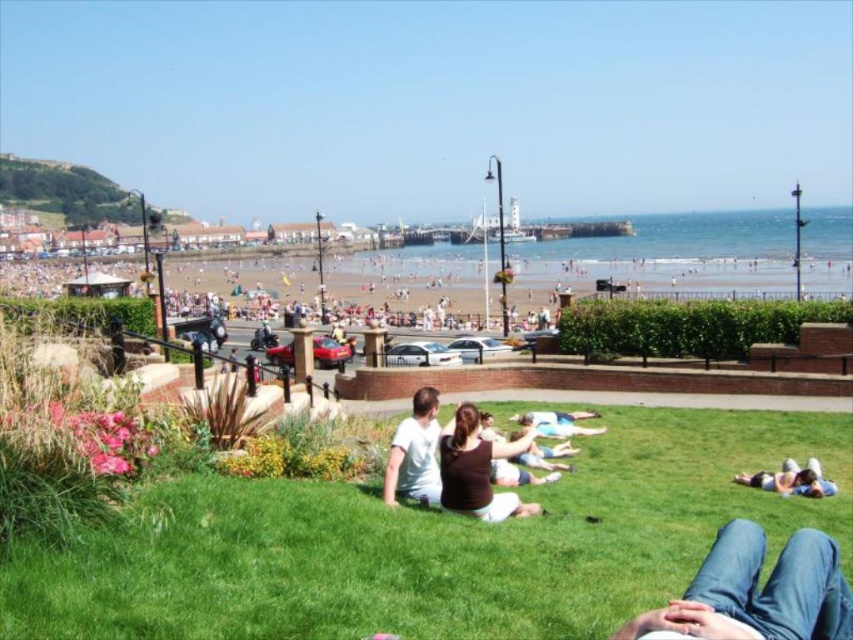
Is jeans at lower right positioned before white cotton shirt at center?

Yes, jeans at lower right is in front of white cotton shirt at center.

Between jeans at lower right and white cotton shirt at center, which one appears on the left side from the viewer's perspective?

white cotton shirt at center is more to the left.

Find the location of a particular element. The width and height of the screenshot is (853, 640). jeans at lower right is located at coordinates (756, 593).

Is jeans at lower right above brown fabric shirt at center?

No, jeans at lower right is not above brown fabric shirt at center.

Based on the photo, which is more to the left, jeans at lower right or brown fabric shirt at center?

From the viewer's perspective, brown fabric shirt at center appears more on the left side.

Locate an element on the screen. jeans at lower right is located at coordinates (756, 593).

At what (x,y) coordinates should I click in order to perform the action: click on jeans at lower right. Please return your answer as a coordinate pair (x, y). Image resolution: width=853 pixels, height=640 pixels. Looking at the image, I should click on (756, 593).

Which of these two, white cotton shirt at center or light blue fabric at center, stands taller?

white cotton shirt at center

Does white cotton shirt at center appear on the right side of light blue fabric at center?

In fact, white cotton shirt at center is to the left of light blue fabric at center.

Find the location of a particular element. The height and width of the screenshot is (640, 853). white cotton shirt at center is located at coordinates (415, 452).